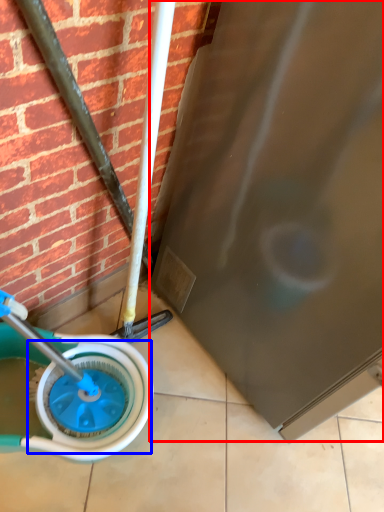
Question: Which object appears closest to the camera in this image, screen door (highlighted by a red box) or wheel (highlighted by a blue box)?

Choices:
 (A) screen door
 (B) wheel

Answer: (A)